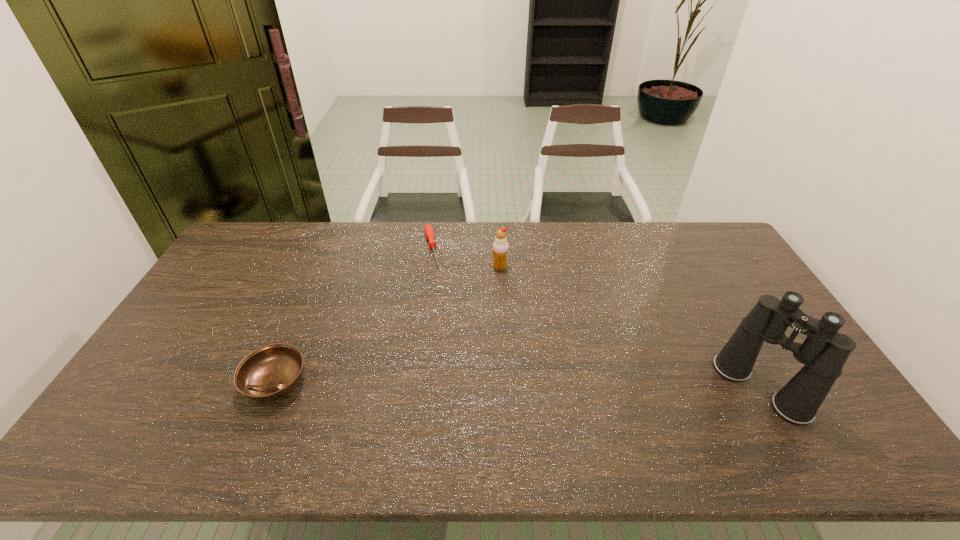
In order to click on vacant position located 0.310m at the front with a straw on the icecream in this screenshot , I will do `click(484, 340)`.

Where is `vacant space located at the front with a straw on the icecream`? Image resolution: width=960 pixels, height=540 pixels. vacant space located at the front with a straw on the icecream is located at coordinates (485, 338).

The width and height of the screenshot is (960, 540). Find the location of `vacant area situated at the front with a straw on the icecream`. vacant area situated at the front with a straw on the icecream is located at coordinates (484, 340).

Where is `vacant space located 0.400m at the tip of the screwdriver`? Image resolution: width=960 pixels, height=540 pixels. vacant space located 0.400m at the tip of the screwdriver is located at coordinates (452, 359).

At what (x,y) coordinates should I click in order to perform the action: click on free point located at the tip of the screwdriver. Please return your answer as a coordinate pair (x, y). The width and height of the screenshot is (960, 540). Looking at the image, I should click on (436, 288).

Where is `vacant space located at the tip of the screwdriver`? vacant space located at the tip of the screwdriver is located at coordinates (444, 327).

Find the location of `object located in the far edge section of the desktop`. object located in the far edge section of the desktop is located at coordinates (429, 232).

You are a GUI agent. You are given a task and a screenshot of the screen. Output one action in this format:
    pyautogui.click(x=<x>, y=<y>)
    Task: Click on the soup bowl present at the near edge
    This screenshot has height=540, width=960.
    Given the screenshot: What is the action you would take?
    pyautogui.click(x=269, y=373)

At what (x,y) coordinates should I click in order to perform the action: click on binoculars located in the near edge section of the desktop. Please return your answer as a coordinate pair (x, y). The image size is (960, 540). Looking at the image, I should click on (824, 352).

Identify the location of object that is at the right edge. This screenshot has height=540, width=960. (824, 352).